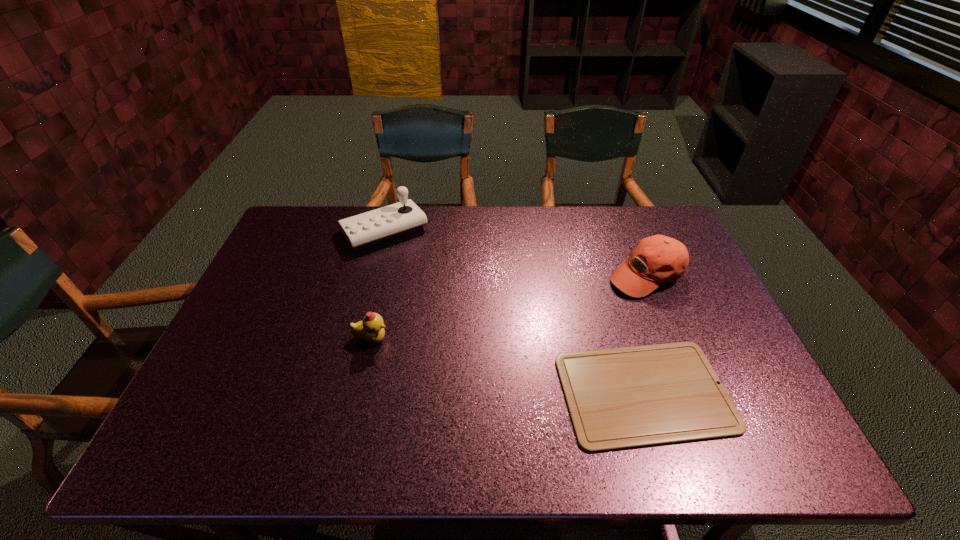
You are a GUI agent. You are given a task and a screenshot of the screen. Output one action in this format:
    pyautogui.click(x=<x>, y=<y>)
    Task: Click on the baseball cap present at the right edge
    The image size is (960, 540).
    Given the screenshot: What is the action you would take?
    pyautogui.click(x=655, y=259)

Locate an element on the screen. This screenshot has width=960, height=540. chopping board that is at the right edge is located at coordinates [621, 398].

Locate an element on the screen. The width and height of the screenshot is (960, 540). object that is at the near right corner is located at coordinates (621, 398).

What are the coordinates of `vacant space at the far edge of the desktop` in the screenshot? It's located at (427, 214).

Locate an element on the screen. This screenshot has height=540, width=960. vacant space at the near edge of the desktop is located at coordinates (360, 458).

The width and height of the screenshot is (960, 540). What are the coordinates of `vacant space at the left edge of the desktop` in the screenshot? It's located at (296, 254).

In the image, there is a desktop. Where is `vacant space at the far left corner`? vacant space at the far left corner is located at coordinates (301, 238).

This screenshot has height=540, width=960. What are the coordinates of `vacant space at the near left corner of the desktop` in the screenshot? It's located at (210, 426).

Locate an element on the screen. vacant area at the near right corner of the desktop is located at coordinates (733, 456).

The width and height of the screenshot is (960, 540). Find the location of `vacant region between the baseball cap and the duckling`. vacant region between the baseball cap and the duckling is located at coordinates (509, 307).